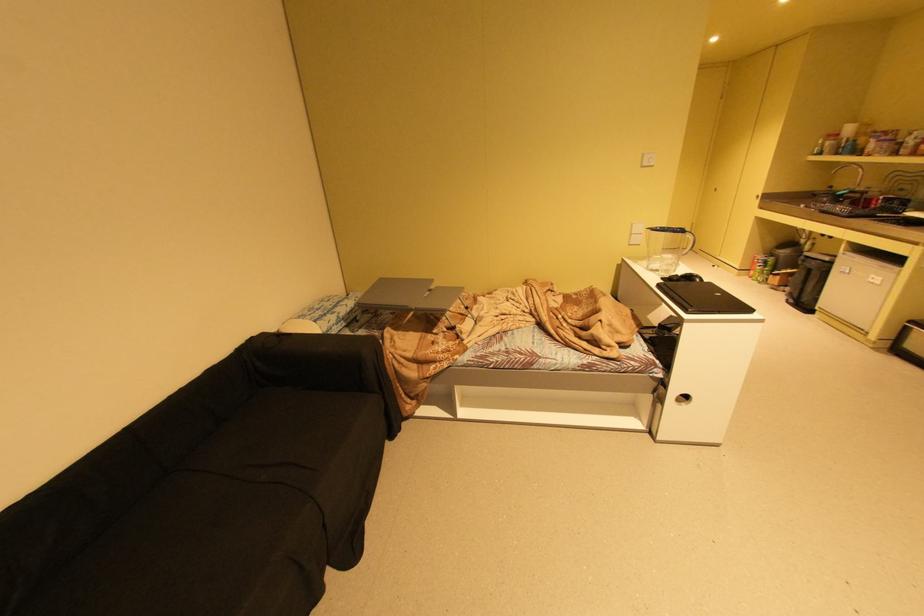
The image size is (924, 616). What do you see at coordinates (637, 228) in the screenshot? I see `the white light switch` at bounding box center [637, 228].